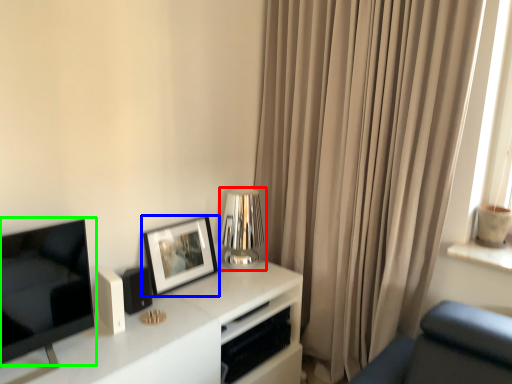
Question: Based on their relative distances, which object is farther from table lamp (highlighted by a red box)? Choose from picture frame (highlighted by a blue box) and television (highlighted by a green box).

Choices:
 (A) picture frame
 (B) television

Answer: (B)